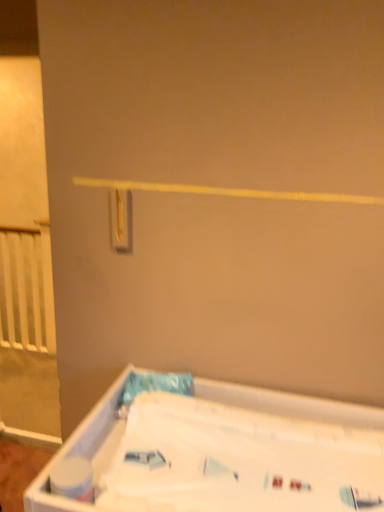
Question: Is gold metallic light switch at upper center wider than white plastic bathtub at lower right?

Choices:
 (A) no
 (B) yes

Answer: (A)

Question: From a real-world perspective, is gold metallic light switch at upper center located beneath white plastic bathtub at lower right?

Choices:
 (A) yes
 (B) no

Answer: (B)

Question: Does gold metallic light switch at upper center have a smaller size compared to white plastic bathtub at lower right?

Choices:
 (A) yes
 (B) no

Answer: (A)

Question: Is white plastic bathtub at lower right inside gold metallic light switch at upper center?

Choices:
 (A) no
 (B) yes

Answer: (A)

Question: Is gold metallic light switch at upper center next to white plastic bathtub at lower right?

Choices:
 (A) no
 (B) yes

Answer: (A)

Question: Considering their positions, is gold metallic light switch at upper center located in front of or behind white matte toilet paper at lower left?

Choices:
 (A) front
 (B) behind

Answer: (B)

Question: Looking at the image, does gold metallic light switch at upper center seem bigger or smaller compared to white matte toilet paper at lower left?

Choices:
 (A) big
 (B) small

Answer: (B)

Question: Is gold metallic light switch at upper center to the left or to the right of white matte toilet paper at lower left in the image?

Choices:
 (A) left
 (B) right

Answer: (B)

Question: From a real-world perspective, relative to white matte toilet paper at lower left, is gold metallic light switch at upper center vertically above or below?

Choices:
 (A) below
 (B) above

Answer: (B)

Question: From a real-world perspective, is gold metallic light switch at upper center positioned above or below white plastic bathtub at lower right?

Choices:
 (A) above
 (B) below

Answer: (A)

Question: Considering the positions of gold metallic light switch at upper center and white plastic bathtub at lower right in the image, is gold metallic light switch at upper center taller or shorter than white plastic bathtub at lower right?

Choices:
 (A) short
 (B) tall

Answer: (A)

Question: From the image's perspective, is gold metallic light switch at upper center located above or below white plastic bathtub at lower right?

Choices:
 (A) above
 (B) below

Answer: (A)

Question: Do you think gold metallic light switch at upper center is within white plastic bathtub at lower right, or outside of it?

Choices:
 (A) inside
 (B) outside

Answer: (B)

Question: Relative to gold metallic light switch at upper center, is white plastic bathtub at lower right in front or behind?

Choices:
 (A) behind
 (B) front

Answer: (B)

Question: Considering the positions of white plastic bathtub at lower right and gold metallic light switch at upper center in the image, is white plastic bathtub at lower right bigger or smaller than gold metallic light switch at upper center?

Choices:
 (A) big
 (B) small

Answer: (A)